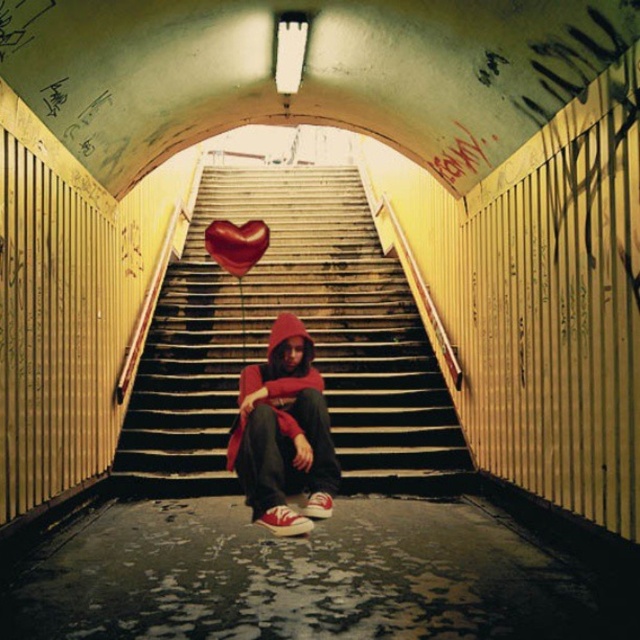
Question: Which of the following is the closest to the observer?

Choices:
 (A) (221, 243)
 (B) (300, 346)

Answer: (B)

Question: From the image, what is the correct spatial relationship of smooth concrete stairs at center in relation to red matte hoodie at center?

Choices:
 (A) above
 (B) below

Answer: (A)

Question: Which of the following is the farthest from the observer?

Choices:
 (A) red matte hoodie at center
 (B) shiny red heart at center

Answer: (B)

Question: Which object appears farthest from the camera in this image?

Choices:
 (A) red matte hoodie at center
 (B) shiny red heart at center

Answer: (B)

Question: Can you confirm if red matte hoodie at center is positioned to the right of shiny red heart at center?

Choices:
 (A) no
 (B) yes

Answer: (B)

Question: Is smooth concrete stairs at center behind shiny red heart at center?

Choices:
 (A) yes
 (B) no

Answer: (A)